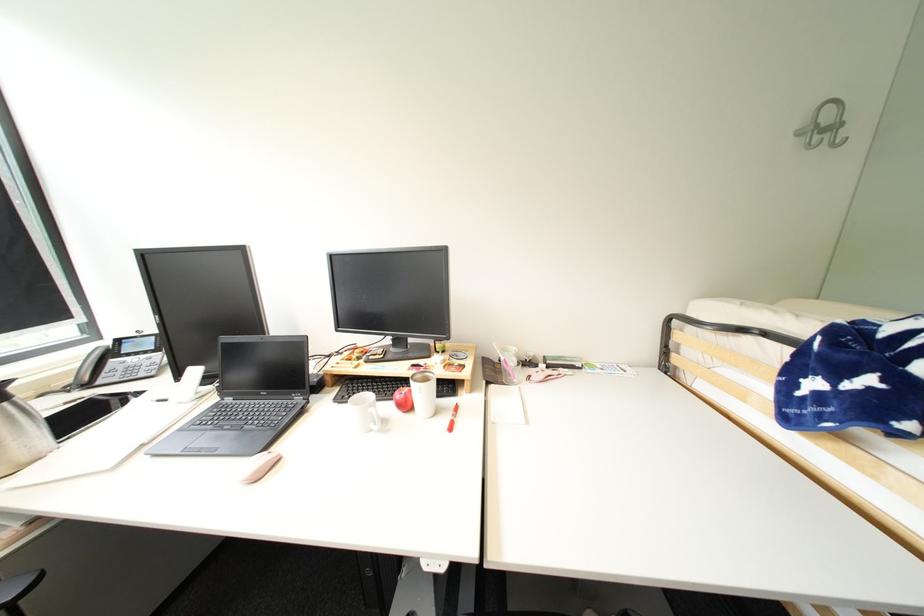
You are a GUI agent. You are given a task and a screenshot of the screen. Output one action in this format:
    pyautogui.click(x=<x>, y=<y>)
    Task: Click on the pink computer mouse
    This screenshot has height=616, width=924.
    Given the screenshot: What is the action you would take?
    pyautogui.click(x=261, y=466)